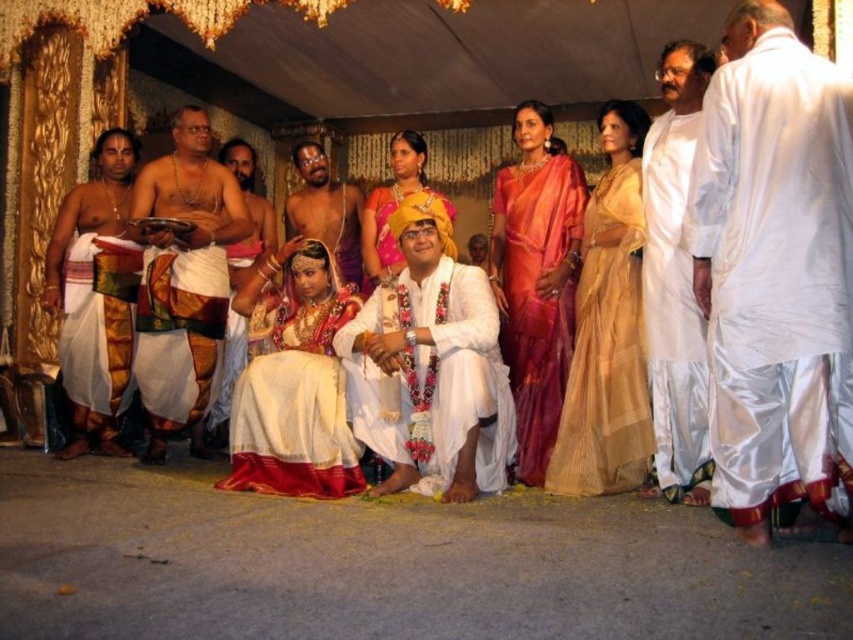
Can you confirm if white satin dhoti at right is taller than matte gold saree at center?

Yes.

Does white satin dhoti at right have a lesser height compared to matte gold saree at center?

No.

Who is more distant from viewer, [825,145] or [378,276]?

Positioned behind is point [378,276].

Where is `white satin dhoti at right`? This screenshot has height=640, width=853. white satin dhoti at right is located at coordinates (772, 264).

Which is more to the left, matte white dhoti at left or matte white saree at left?

matte white saree at left

Between point (135, 323) and point (126, 170), which one is positioned in front?

Point (135, 323)

I want to click on matte white dhoti at left, so click(x=183, y=282).

Between point (161, 314) and point (363, 253), which one is positioned in front?

Positioned in front is point (161, 314).

Between matte white dhoti at left and matte gold saree at center, which one appears on the right side from the viewer's perspective?

From the viewer's perspective, matte gold saree at center appears more on the right side.

What do you see at coordinates (183, 282) in the screenshot? The height and width of the screenshot is (640, 853). I see `matte white dhoti at left` at bounding box center [183, 282].

In order to click on matte white dhoti at left in this screenshot , I will do `click(183, 282)`.